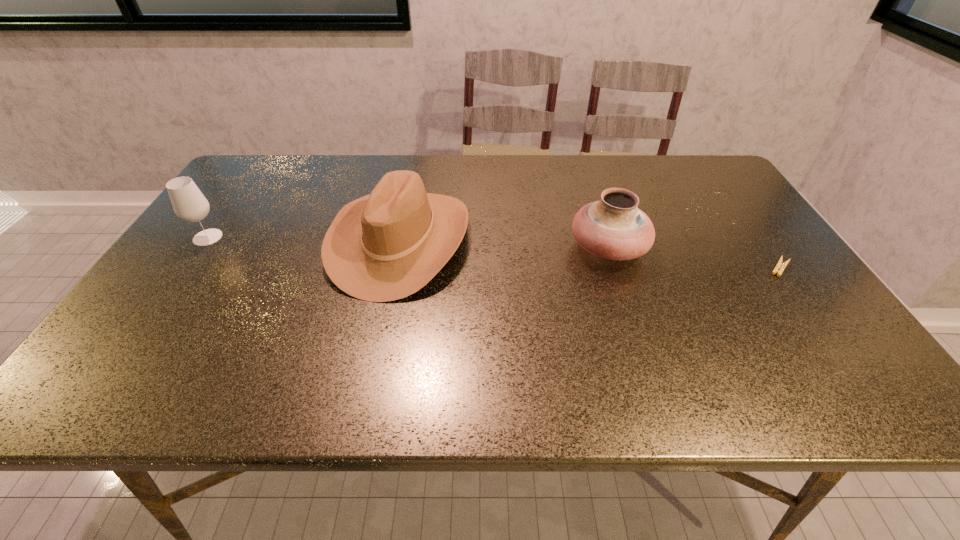
This screenshot has height=540, width=960. Find the location of `vacant region that satisfies the following two spatial constraints: 1. on the front side of the leftmost object; 2. on the right side of the rightmost object`. vacant region that satisfies the following two spatial constraints: 1. on the front side of the leftmost object; 2. on the right side of the rightmost object is located at coordinates (186, 268).

Where is `free space in the image that satisfies the following two spatial constraints: 1. on the front side of the shortest object; 2. on the left side of the glass`? This screenshot has height=540, width=960. free space in the image that satisfies the following two spatial constraints: 1. on the front side of the shortest object; 2. on the left side of the glass is located at coordinates (186, 268).